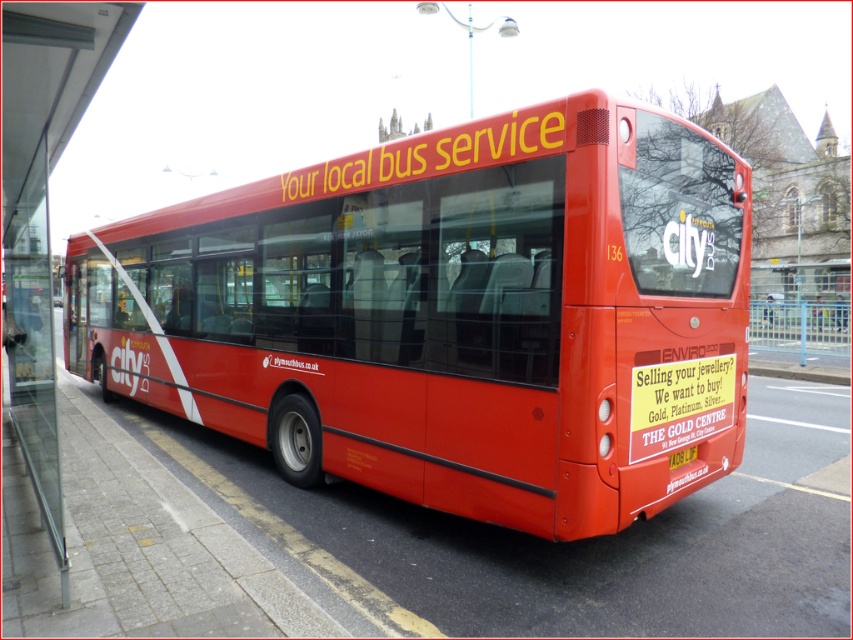
Does glossy red bus at center appear over yellow plastic license plate at center?

Yes.

Who is shorter, glossy red bus at center or yellow plastic license plate at center?

yellow plastic license plate at center

This screenshot has width=853, height=640. What do you see at coordinates (451, 314) in the screenshot?
I see `glossy red bus at center` at bounding box center [451, 314].

The image size is (853, 640). What are the coordinates of `glossy red bus at center` in the screenshot? It's located at (451, 314).